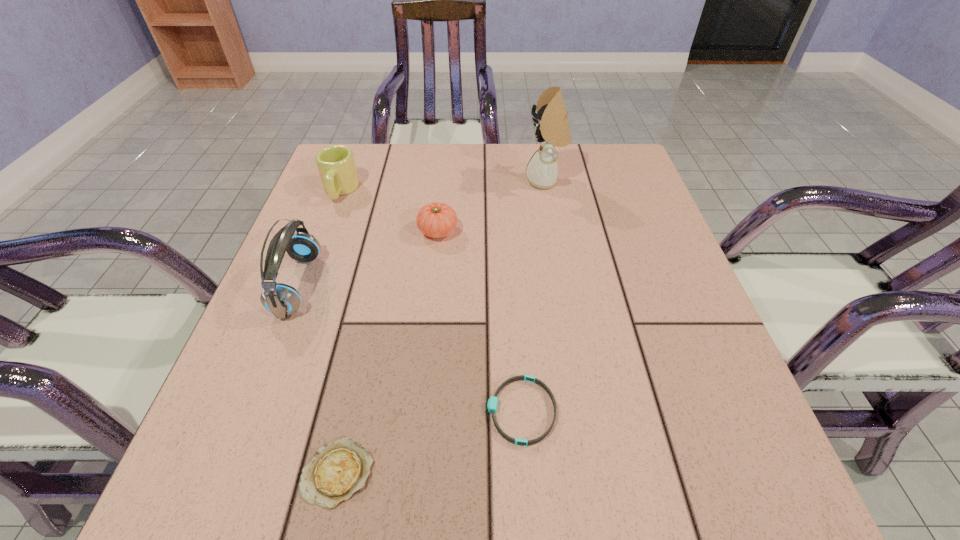
Identify the location of the tallest object. The height and width of the screenshot is (540, 960). (552, 129).

I want to click on the third nearest object, so click(x=282, y=300).

This screenshot has width=960, height=540. Identify the location of headset. (282, 300).

Locate an element on the screen. This screenshot has height=540, width=960. mug is located at coordinates (336, 165).

Locate an element on the screen. The width and height of the screenshot is (960, 540). the fourth object from left to right is located at coordinates (436, 220).

Find the location of a particular element. This screenshot has width=960, height=540. tomato is located at coordinates (436, 220).

You are a GUI agent. You are given a task and a screenshot of the screen. Output one action in this format:
    pyautogui.click(x=<x>, y=<y>)
    Task: Click on the second shortest object
    
    Given the screenshot: What is the action you would take?
    pyautogui.click(x=493, y=400)

You are a GUI agent. You are given a task and a screenshot of the screen. Output one action in this format:
    pyautogui.click(x=<x>, y=<y>)
    Task: Click on the fourth object from right to left
    
    Given the screenshot: What is the action you would take?
    pyautogui.click(x=339, y=469)

In order to click on the shortest object in this screenshot , I will do `click(339, 469)`.

Identify the location of free region located at the front face of the tallest object. Image resolution: width=960 pixels, height=540 pixels. (408, 181).